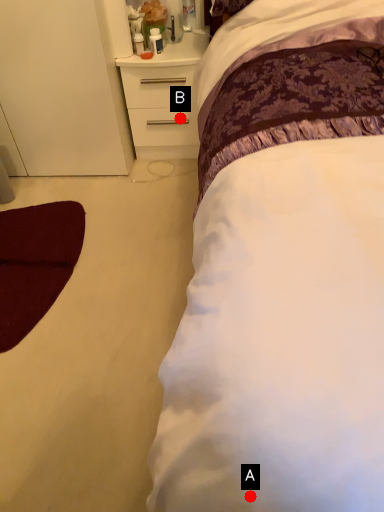
Question: Two points are circled on the image, labeled by A and B beside each circle. Which point is farther to the camera?

Choices:
 (A) A is further
 (B) B is further

Answer: (B)